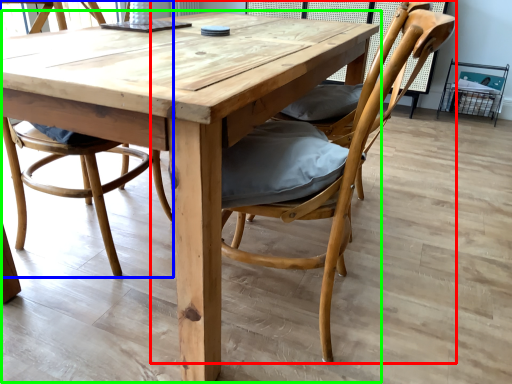
Question: Which object is positioned closest to chair (highlighted by a red box)? Select from chair (highlighted by a blue box) and kitchen & dining room table (highlighted by a green box).

Choices:
 (A) chair
 (B) kitchen & dining room table

Answer: (B)